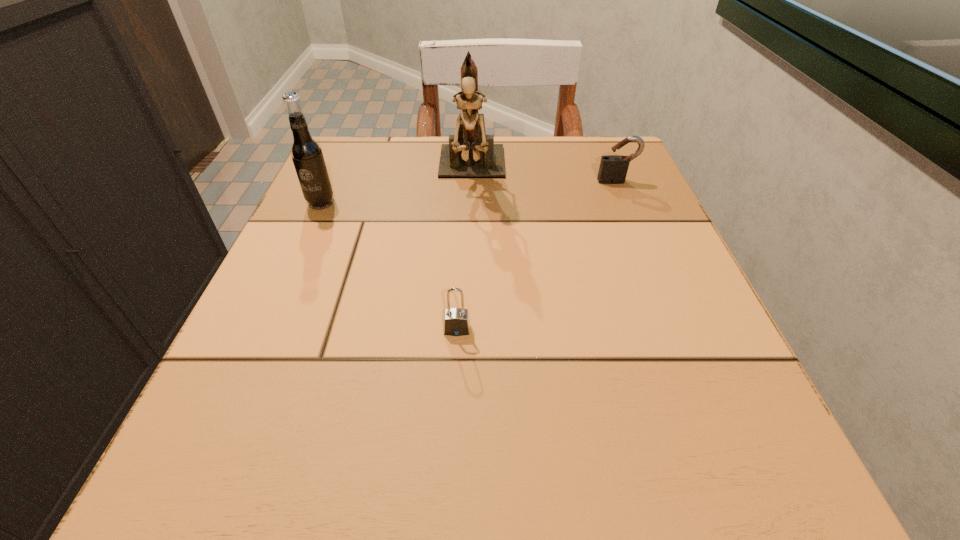
The width and height of the screenshot is (960, 540). I want to click on free space between the figurine and the shortest object, so click(465, 251).

At what (x,y) coordinates should I click in order to perform the action: click on free space between the third tallest object and the root beer. Please return your answer as a coordinate pair (x, y). This screenshot has width=960, height=540. Looking at the image, I should click on (468, 192).

Locate an element on the screen. This screenshot has height=540, width=960. free area in between the root beer and the figurine is located at coordinates (396, 187).

Locate an element on the screen. vacant region between the third shortest object and the third tallest object is located at coordinates (468, 192).

Identify which object is the third nearest to the figurine. Please provide its 2D coordinates. Your answer should be formatted as a tuple, i.e. [(x, y)], where the tuple contains the x and y coordinates of a point satisfying the conditions above.

[(456, 320)]

Select which object is the closest to the rightmost object. Please provide its 2D coordinates. Your answer should be formatted as a tuple, i.e. [(x, y)], where the tuple contains the x and y coordinates of a point satisfying the conditions above.

[(471, 153)]